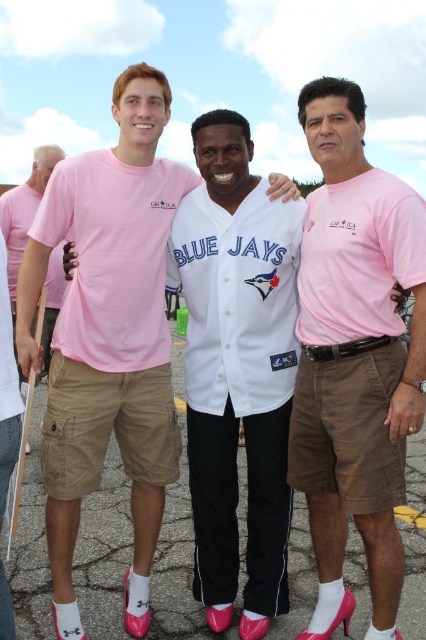
Does pink cotton shirt at right lie behind matte pink t-shirt at left?

No, it is in front of matte pink t-shirt at left.

Between pink cotton shirt at right and matte pink t-shirt at left, which one has more height?

Standing taller between the two is pink cotton shirt at right.

Measure the distance between pink cotton shirt at right and camera.

The distance of pink cotton shirt at right from camera is 3.06 meters.

The height and width of the screenshot is (640, 426). I want to click on pink cotton shirt at right, so click(354, 356).

Does white jersey at center have a smaller size compared to matte pink t-shirt at left?

Yes, white jersey at center is smaller than matte pink t-shirt at left.

This screenshot has width=426, height=640. What do you see at coordinates (238, 385) in the screenshot?
I see `white jersey at center` at bounding box center [238, 385].

What do you see at coordinates (238, 385) in the screenshot? The image size is (426, 640). I see `white jersey at center` at bounding box center [238, 385].

Where is `white jersey at center`? The width and height of the screenshot is (426, 640). white jersey at center is located at coordinates (238, 385).

Between point (356, 93) and point (204, 429), which one is positioned in front?

Point (356, 93) is more forward.

You are a GUI agent. You are given a task and a screenshot of the screen. Output one action in this format:
    pyautogui.click(x=<x>, y=<y>)
    Task: Click on the pink cotton shirt at right
    This screenshot has width=426, height=640.
    Given the screenshot: What is the action you would take?
    pyautogui.click(x=354, y=356)

Find the location of `pink cotton shirt at right`. pink cotton shirt at right is located at coordinates (354, 356).